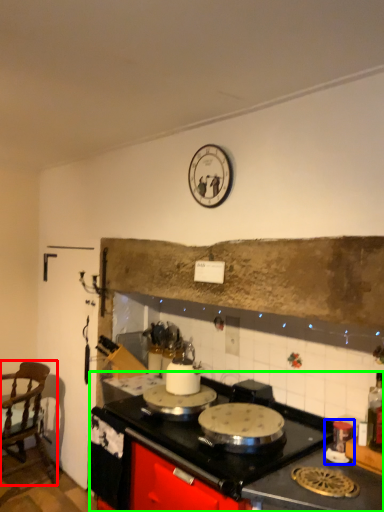
Question: Based on their relative distances, which object is nearer to chair (highlighted by a red box)? Choose from appliance (highlighted by a blue box) and countertop (highlighted by a green box).

Choices:
 (A) appliance
 (B) countertop

Answer: (B)